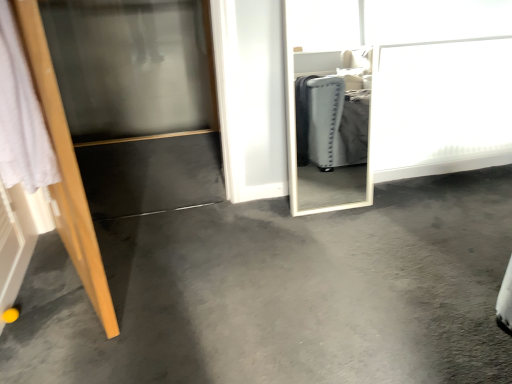
Identify the location of white glossy screen door at upper right, the 1th screen door positioned from the right. The width and height of the screenshot is (512, 384). (441, 108).

The width and height of the screenshot is (512, 384). In order to click on gray carpet at center in this screenshot , I will do [x=282, y=293].

In order to click on wooden door at left in this screenshot , I will do [65, 168].

From the image's perspective, is white glossy screen door at upper right, the 1th screen door positioned from the right, positioned above or below wooden door at left?

Based on their image positions, white glossy screen door at upper right, the 1th screen door positioned from the right, is located above wooden door at left.

Is white glossy screen door at upper right, which appears as the 2th screen door when viewed from the left, turned away from wooden door at left?

No, white glossy screen door at upper right, which appears as the 2th screen door when viewed from the left, is not facing the opposite direction of wooden door at left.

Would you say wooden door at left is part of white glossy screen door at upper right, which appears as the 2th screen door when viewed from the left,'s contents?

No, wooden door at left is not a part of white glossy screen door at upper right, which appears as the 2th screen door when viewed from the left.

Does white glossy screen door at upper right, the 1th screen door positioned from the right, have a smaller size compared to wooden door at left?

Yes, white glossy screen door at upper right, the 1th screen door positioned from the right, is smaller than wooden door at left.

Is point (448, 245) positioned before point (102, 305)?

That is False.

Does gray carpet at center come behind wooden door at left?

Yes.

How much distance is there between gray carpet at center and wooden door at left?

The distance of gray carpet at center from wooden door at left is 24.35 inches.

Would you say gray carpet at center is outside wooden door at left?

Yes, gray carpet at center is outside of wooden door at left.

Is point (234, 349) more distant than point (478, 44)?

No.

Between gray carpet at center and white glossy screen door at upper right, the 1th screen door positioned from the right, which one has smaller width?

Thinner between the two is white glossy screen door at upper right, the 1th screen door positioned from the right.

How different are the orientations of gray carpet at center and white glossy screen door at upper right, the 1th screen door positioned from the right, in degrees?

gray carpet at center and white glossy screen door at upper right, the 1th screen door positioned from the right, are facing 179 degrees away from each other.

Which screen door is the 1st one when counting from the right side of the wooden door at left? Please provide its 2D coordinates.

[(132, 66)]

Which object is thinner, transparent glass screen door at left, placed as the 2th screen door when sorted from right to left, or wooden door at left?

transparent glass screen door at left, placed as the 2th screen door when sorted from right to left.

Considering the sizes of transparent glass screen door at left, marked as the 1th screen door in a left-to-right arrangement, and wooden door at left in the image, is transparent glass screen door at left, marked as the 1th screen door in a left-to-right arrangement, taller or shorter than wooden door at left?

transparent glass screen door at left, marked as the 1th screen door in a left-to-right arrangement, is shorter than wooden door at left.

From the image's perspective, is transparent glass screen door at left, marked as the 1th screen door in a left-to-right arrangement, beneath wooden door at left?

No.

Measure the distance from white glossy screen door at upper right, the 1th screen door positioned from the right, to transparent glass screen door at left, placed as the 2th screen door when sorted from right to left.

white glossy screen door at upper right, the 1th screen door positioned from the right, is 2.38 meters away from transparent glass screen door at left, placed as the 2th screen door when sorted from right to left.

Do you think white glossy screen door at upper right, the 1th screen door positioned from the right, is within transparent glass screen door at left, marked as the 1th screen door in a left-to-right arrangement, or outside of it?

white glossy screen door at upper right, the 1th screen door positioned from the right, is outside transparent glass screen door at left, marked as the 1th screen door in a left-to-right arrangement.

Which object is thinner, white glossy screen door at upper right, which appears as the 2th screen door when viewed from the left, or transparent glass screen door at left, placed as the 2th screen door when sorted from right to left?

white glossy screen door at upper right, which appears as the 2th screen door when viewed from the left, is thinner.

Which point is more distant from viewer, (431, 96) or (60, 28)?

The point (60, 28) is more distant.

Consider the image. Could you tell me if gray carpet at center is turned towards transparent glass screen door at left, marked as the 1th screen door in a left-to-right arrangement?

No, gray carpet at center is not facing towards transparent glass screen door at left, marked as the 1th screen door in a left-to-right arrangement.

Considering the positions of objects gray carpet at center and transparent glass screen door at left, marked as the 1th screen door in a left-to-right arrangement, in the image provided, who is in front, gray carpet at center or transparent glass screen door at left, marked as the 1th screen door in a left-to-right arrangement,?

gray carpet at center is more forward.

What are the coordinates of `concrete below the transparent glass screen door at left, marked as the 1th screen door in a left-to-right arrangement (from a real-world perspective)` in the screenshot? It's located at (282, 293).

Can we say transparent glass screen door at left, placed as the 2th screen door when sorted from right to left, lies outside white glossy screen door at upper right, which appears as the 2th screen door when viewed from the left?

Indeed, transparent glass screen door at left, placed as the 2th screen door when sorted from right to left, is completely outside white glossy screen door at upper right, which appears as the 2th screen door when viewed from the left.

Between transparent glass screen door at left, placed as the 2th screen door when sorted from right to left, and white glossy screen door at upper right, the 1th screen door positioned from the right, which one has larger width?

transparent glass screen door at left, placed as the 2th screen door when sorted from right to left, is wider.

Locate an element on the screen. The image size is (512, 384). screen door located on the right of transparent glass screen door at left, placed as the 2th screen door when sorted from right to left is located at coordinates (441, 108).

Locate an element on the screen. the 2nd screen door counting from the right of the wooden door at left is located at coordinates (441, 108).

Image resolution: width=512 pixels, height=384 pixels. I want to click on door above the gray carpet at center (from the image's perspective), so click(65, 168).

From the picture: Based on their spatial positions, is transparent glass screen door at left, placed as the 2th screen door when sorted from right to left, or white glossy screen door at upper right, which appears as the 2th screen door when viewed from the left, closer to gray carpet at center?

Based on the image, white glossy screen door at upper right, which appears as the 2th screen door when viewed from the left, appears to be nearer to gray carpet at center.

Considering their positions, is wooden door at left positioned further to gray carpet at center than transparent glass screen door at left, marked as the 1th screen door in a left-to-right arrangement?

The object further to gray carpet at center is transparent glass screen door at left, marked as the 1th screen door in a left-to-right arrangement.

When comparing their distances from white glossy screen door at upper right, which appears as the 2th screen door when viewed from the left, does gray carpet at center or transparent glass screen door at left, marked as the 1th screen door in a left-to-right arrangement, seem further?

Among the two, transparent glass screen door at left, marked as the 1th screen door in a left-to-right arrangement, is located further to white glossy screen door at upper right, which appears as the 2th screen door when viewed from the left.

When comparing their distances from gray carpet at center, does transparent glass screen door at left, marked as the 1th screen door in a left-to-right arrangement, or wooden door at left seem further?

transparent glass screen door at left, marked as the 1th screen door in a left-to-right arrangement, is positioned further to the anchor gray carpet at center.

Which object lies further to the anchor point wooden door at left, white glossy screen door at upper right, which appears as the 2th screen door when viewed from the left, or gray carpet at center?

white glossy screen door at upper right, which appears as the 2th screen door when viewed from the left, is positioned further to the anchor wooden door at left.

Estimate the real-world distances between objects in this image. Which object is further from white glossy screen door at upper right, the 1th screen door positioned from the right, transparent glass screen door at left, marked as the 1th screen door in a left-to-right arrangement, or wooden door at left?

transparent glass screen door at left, marked as the 1th screen door in a left-to-right arrangement, lies further to white glossy screen door at upper right, the 1th screen door positioned from the right, than the other object.

When comparing their distances from transparent glass screen door at left, marked as the 1th screen door in a left-to-right arrangement, does gray carpet at center or white glossy screen door at upper right, the 1th screen door positioned from the right, seem closer?

Based on the image, white glossy screen door at upper right, the 1th screen door positioned from the right, appears to be nearer to transparent glass screen door at left, marked as the 1th screen door in a left-to-right arrangement.

From the image, which object appears to be nearer to transparent glass screen door at left, placed as the 2th screen door when sorted from right to left, white glossy screen door at upper right, the 1th screen door positioned from the right, or wooden door at left?

wooden door at left lies closer to transparent glass screen door at left, placed as the 2th screen door when sorted from right to left, than the other object.

At what (x,y) coordinates should I click in order to perform the action: click on screen door situated between wooden door at left and gray carpet at center from left to right. Please return your answer as a coordinate pair (x, y). Looking at the image, I should click on (132, 66).

Find the location of a particular element. Image resolution: width=512 pixels, height=384 pixels. screen door between wooden door at left and white glossy screen door at upper right, the 1th screen door positioned from the right, from left to right is located at coordinates (132, 66).

You are a GUI agent. You are given a task and a screenshot of the screen. Output one action in this format:
    pyautogui.click(x=<x>, y=<y>)
    Task: Click on the concrete between transparent glass screen door at left, marked as the 1th screen door in a left-to-right arrangement, and white glossy screen door at upper right, which appears as the 2th screen door when viewed from the left
    
    Given the screenshot: What is the action you would take?
    pyautogui.click(x=282, y=293)

This screenshot has width=512, height=384. Identify the location of concrete situated between wooden door at left and white glossy screen door at upper right, the 1th screen door positioned from the right, from left to right. (282, 293).